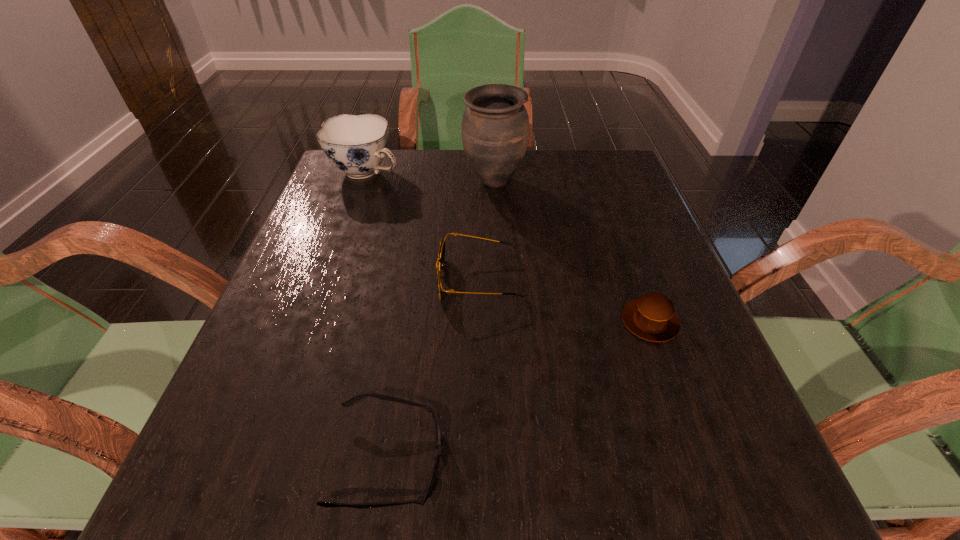
In the image, there is a desktop. Where is `vacant space at the near edge`? The height and width of the screenshot is (540, 960). vacant space at the near edge is located at coordinates (646, 493).

Locate an element on the screen. This screenshot has height=540, width=960. free space at the left edge of the desktop is located at coordinates (250, 430).

Locate an element on the screen. The image size is (960, 540). vacant area at the right edge of the desktop is located at coordinates (x=617, y=285).

I want to click on free point at the far right corner, so click(x=638, y=194).

The width and height of the screenshot is (960, 540). Identify the location of free space at the near right corner of the desktop. (749, 491).

You are a GUI agent. You are given a task and a screenshot of the screen. Output one action in this format:
    pyautogui.click(x=<x>, y=<y>)
    Task: Click on the free spot between the fourth shortest object and the shorter sunglasses
    The height and width of the screenshot is (540, 960).
    Given the screenshot: What is the action you would take?
    pyautogui.click(x=377, y=316)

I want to click on empty space that is in between the rightmost object and the taller sunglasses, so click(x=565, y=300).

You are a GUI agent. You are given a task and a screenshot of the screen. Output one action in this format:
    pyautogui.click(x=<x>, y=<y>)
    Task: Click on the empty space that is in between the urn and the muffin
    
    Given the screenshot: What is the action you would take?
    pyautogui.click(x=572, y=252)

Where is `free space that is in between the shorter sunglasses and the chinaware`? Image resolution: width=960 pixels, height=540 pixels. free space that is in between the shorter sunglasses and the chinaware is located at coordinates (377, 316).

The width and height of the screenshot is (960, 540). What are the coordinates of `vacant area between the rightmost object and the farther sunglasses` in the screenshot? It's located at (565, 300).